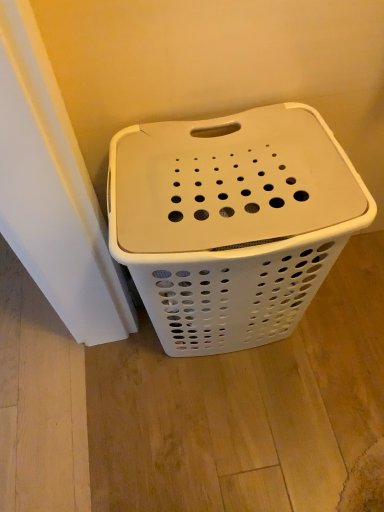
Question: Should I look upward or downward to see white plastic laundry basket at center?

Choices:
 (A) up
 (B) down

Answer: (B)